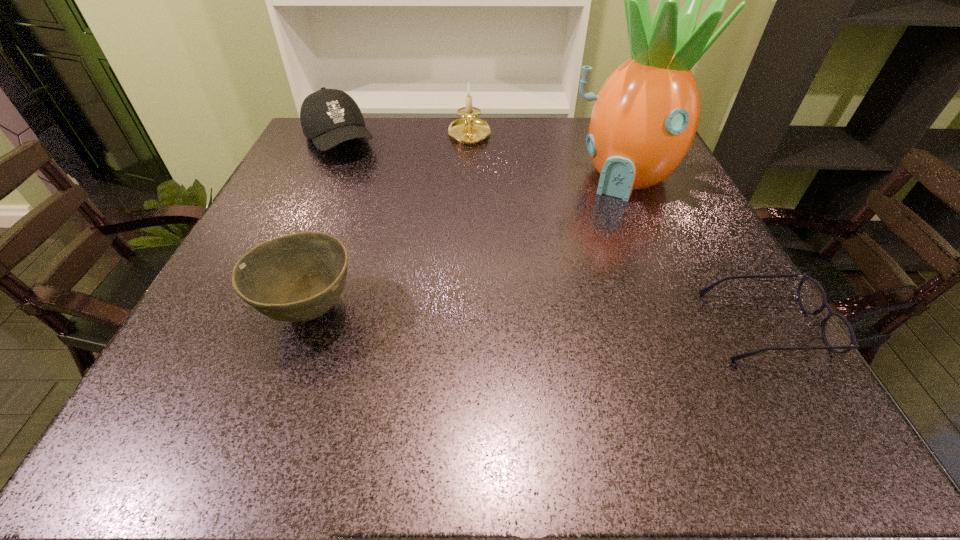
At what (x,y) coordinates should I click in order to perform the action: click on free space located 0.140m on the front-facing side of the baseball cap. Please return your answer as a coordinate pair (x, y). The height and width of the screenshot is (540, 960). Looking at the image, I should click on click(372, 191).

Locate an element on the screen. Image resolution: width=960 pixels, height=540 pixels. vacant space situated on the front-facing side of the baseball cap is located at coordinates (416, 252).

Find the location of a particular element. This screenshot has height=540, width=960. free space located 0.070m at the entrance of the pineapple is located at coordinates (601, 220).

The height and width of the screenshot is (540, 960). What are the coordinates of `blank space located 0.320m at the entrance of the pineapple` in the screenshot? It's located at (563, 301).

The height and width of the screenshot is (540, 960). I want to click on vacant space located 0.390m at the entrance of the pineapple, so click(x=549, y=330).

Where is `candle holder that is at the far edge`? The image size is (960, 540). candle holder that is at the far edge is located at coordinates (469, 130).

Identify the location of baseball cap located at the far edge. The height and width of the screenshot is (540, 960). (329, 117).

The width and height of the screenshot is (960, 540). I want to click on pineapple that is at the far edge, so click(x=645, y=117).

Image resolution: width=960 pixels, height=540 pixels. I want to click on bowl located in the near edge section of the desktop, so click(x=297, y=277).

Where is `spectacles at the near edge`? This screenshot has width=960, height=540. spectacles at the near edge is located at coordinates (838, 334).